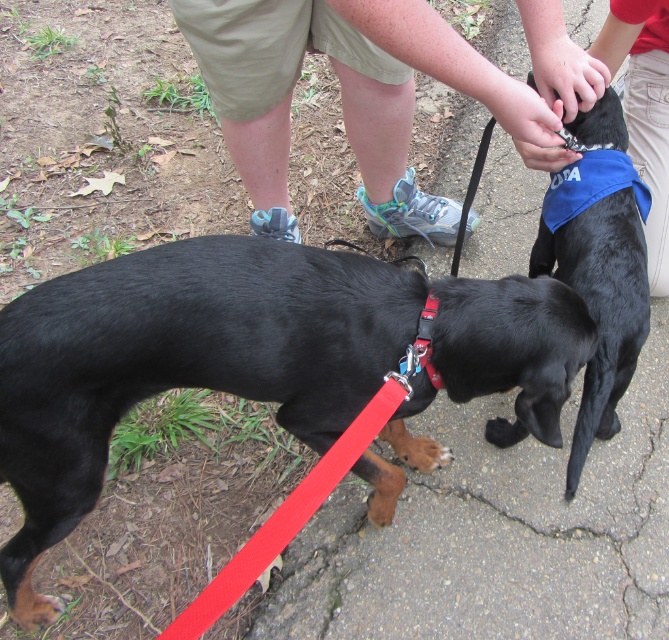
Is point (268, 397) less distant than point (559, 211)?

Yes.

Which is in front, point (98, 490) or point (603, 147)?

Point (98, 490) is more forward.

What are the coordinates of `black smooth dog at center` in the screenshot? It's located at (246, 358).

The height and width of the screenshot is (640, 669). I want to click on black smooth dog at center, so click(246, 358).

Does tan/khaki shorts at center appear under blue fabric dog at center?

Incorrect, tan/khaki shorts at center is not positioned below blue fabric dog at center.

Image resolution: width=669 pixels, height=640 pixels. Identify the location of tan/khaki shorts at center. (369, 92).

Identify the location of tan/khaki shorts at center. This screenshot has width=669, height=640. (369, 92).

Where is `black smooth dog at center`? black smooth dog at center is located at coordinates (246, 358).

Which is in front, point (559, 294) or point (545, 49)?

Point (559, 294)

Does point (104, 288) lie in front of point (429, 225)?

Yes, point (104, 288) is in front of point (429, 225).

You are a GUI agent. You are given a task and a screenshot of the screen. Output one action in this format:
    pyautogui.click(x=<x>, y=<y>)
    Task: Click on the black smooth dog at center
    
    Given the screenshot: What is the action you would take?
    pyautogui.click(x=246, y=358)